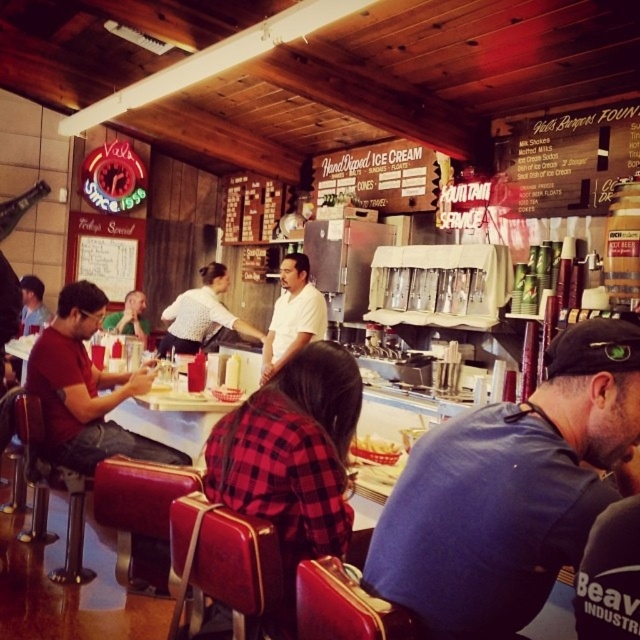
Is white paperboard menu at upper right wider than matte black shirt at left?

No, white paperboard menu at upper right is not wider than matte black shirt at left.

Measure the distance between white paperboard menu at upper right and matte black shirt at left.

white paperboard menu at upper right is 4.08 meters from matte black shirt at left.

Image resolution: width=640 pixels, height=640 pixels. What are the coordinates of `white paperboard menu at upper right` in the screenshot? It's located at (564, 157).

From the picture: Between white shirt at center and matte black shirt at left, which one has more height?

white shirt at center

I want to click on white shirt at center, so click(202, 314).

The width and height of the screenshot is (640, 640). I want to click on white shirt at center, so click(x=202, y=314).

The image size is (640, 640). Find the location of `white shirt at center`. white shirt at center is located at coordinates (202, 314).

Describe the element at coordinates (509, 492) in the screenshot. I see `blue cotton shirt at center` at that location.

Who is positioned more to the right, blue cotton shirt at center or golden crispy french fries at center?

blue cotton shirt at center is more to the right.

This screenshot has height=640, width=640. What are the coordinates of `blue cotton shirt at center` in the screenshot? It's located at (509, 492).

At what (x,y) coordinates should I click in order to perform the action: click on blue cotton shirt at center. Please return your answer as a coordinate pair (x, y). Image resolution: width=640 pixels, height=640 pixels. Looking at the image, I should click on (509, 492).